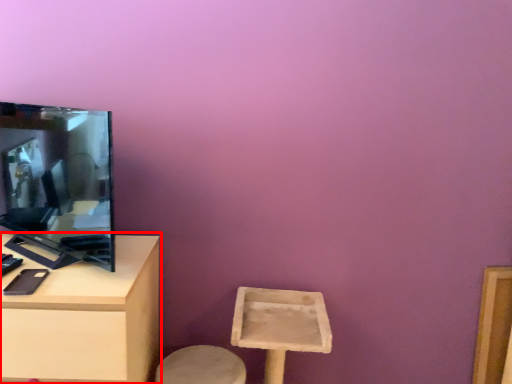
Question: From the image's perspective, where is table (annotated by the red box) located relative to television?

Choices:
 (A) below
 (B) above

Answer: (A)